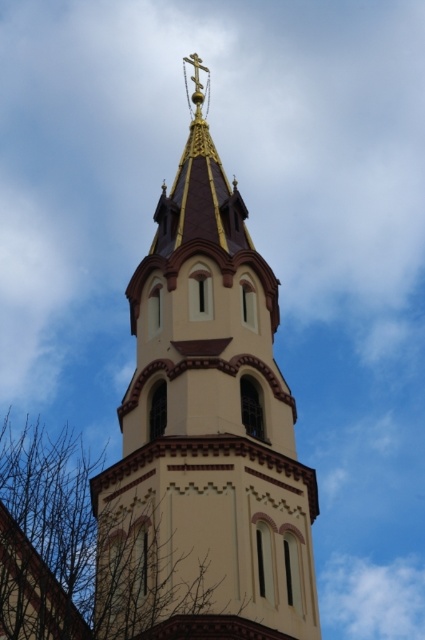
Question: Which of the following is the closest to the observer?

Choices:
 (A) (121, 468)
 (B) (37, 468)

Answer: (A)

Question: Can you confirm if matte gold spire at center is positioned to the right of brown leafless branches at lower left?

Choices:
 (A) no
 (B) yes

Answer: (B)

Question: Is matte gold spire at center below brown leafless branches at lower left?

Choices:
 (A) yes
 (B) no

Answer: (B)

Question: Is matte gold spire at center above brown leafless branches at lower left?

Choices:
 (A) yes
 (B) no

Answer: (A)

Question: Which of the following is the closest to the observer?

Choices:
 (A) (274, 433)
 (B) (101, 628)

Answer: (B)